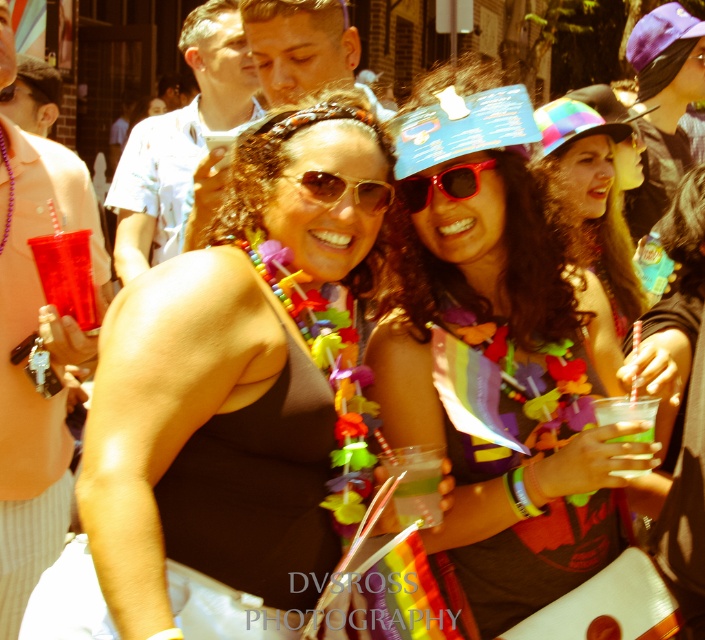
Is point (393, 490) positioned in front of point (637, 433)?

No.

Is point (400, 481) farther from viewer compared to point (646, 420)?

Yes, it is behind point (646, 420).

The width and height of the screenshot is (705, 640). I want to click on green translucent glass at center, so click(x=415, y=483).

Is matte black dress at center to the right of gold metallic sunglasses at center from the viewer's perspective?

Incorrect, matte black dress at center is not on the right side of gold metallic sunglasses at center.

Measure the distance between point (266, 337) and camera.

They are 21.09 feet apart.

Locate an element on the screen. The height and width of the screenshot is (640, 705). matte black dress at center is located at coordinates click(219, 410).

Between gold metallic sunglasses at center and clear plastic cup at lower right, which one has less height?

gold metallic sunglasses at center

The height and width of the screenshot is (640, 705). Identify the location of gold metallic sunglasses at center. (343, 189).

Is point (336, 177) positioned before point (634, 438)?

No, it is not.

At what (x,y) coordinates should I click in order to perform the action: click on gold metallic sunglasses at center. Please return your answer as a coordinate pair (x, y). This screenshot has width=705, height=640. Looking at the image, I should click on (343, 189).